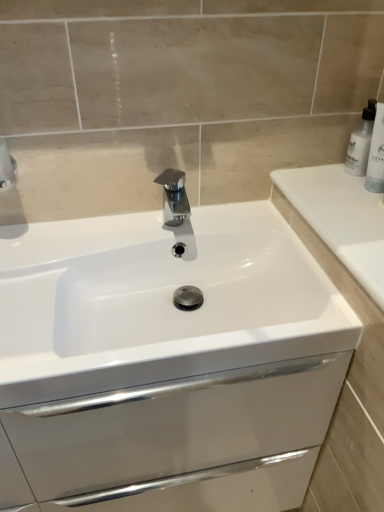
Question: From a real-world perspective, does white glossy sink at center stand above white glossy bottle at upper right?

Choices:
 (A) yes
 (B) no

Answer: (B)

Question: Is white glossy sink at center at the left side of white glossy bottle at upper right?

Choices:
 (A) yes
 (B) no

Answer: (A)

Question: Considering the relative sizes of white glossy sink at center and white glossy bottle at upper right in the image provided, is white glossy sink at center taller than white glossy bottle at upper right?

Choices:
 (A) yes
 (B) no

Answer: (B)

Question: From a real-world perspective, is white glossy sink at center located beneath white glossy bottle at upper right?

Choices:
 (A) no
 (B) yes

Answer: (B)

Question: Is white glossy sink at center positioned with its back to white glossy bottle at upper right?

Choices:
 (A) yes
 (B) no

Answer: (B)

Question: From a real-world perspective, is white plastic bottle at upper right above or below white glossy sink at center?

Choices:
 (A) above
 (B) below

Answer: (A)

Question: In terms of width, does white plastic bottle at upper right look wider or thinner when compared to white glossy sink at center?

Choices:
 (A) wide
 (B) thin

Answer: (B)

Question: Is white plastic bottle at upper right in front of or behind white glossy sink at center in the image?

Choices:
 (A) behind
 (B) front

Answer: (A)

Question: From the image's perspective, is white plastic bottle at upper right above or below white glossy sink at center?

Choices:
 (A) below
 (B) above

Answer: (B)

Question: Looking at their shapes, would you say white glossy sink at center is wider or thinner than polished chrome tap at center?

Choices:
 (A) wide
 (B) thin

Answer: (A)

Question: Relative to polished chrome tap at center, is white glossy sink at center in front or behind?

Choices:
 (A) front
 (B) behind

Answer: (A)

Question: From the image's perspective, is white glossy sink at center positioned above or below polished chrome tap at center?

Choices:
 (A) below
 (B) above

Answer: (A)

Question: Is white glossy sink at center taller or shorter than polished chrome tap at center?

Choices:
 (A) tall
 (B) short

Answer: (A)

Question: From a real-world perspective, is white glossy bottle at upper right above or below polished chrome tap at center?

Choices:
 (A) below
 (B) above

Answer: (B)

Question: Is point (370, 167) positioned closer to the camera than point (168, 188)?

Choices:
 (A) farther
 (B) closer

Answer: (B)